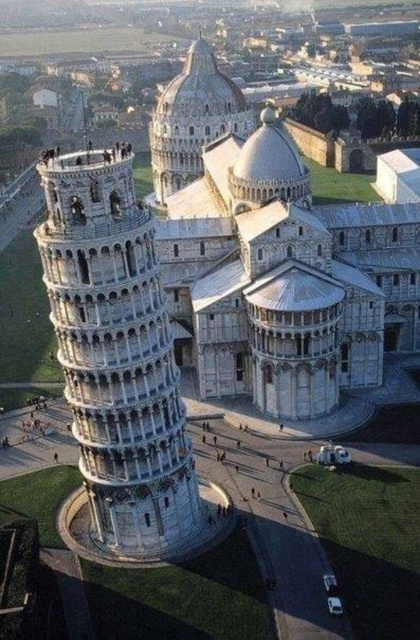
You are standing in the Piazza dei Miracoli and want to take a photo that includes both the white stone tower at left and the white stone dome at upper center. Based on their positions, which one should you frame first in your camera viewfinder to ensure both are in the shot?

The white stone tower at left is below the white stone dome at upper center, so you should frame the white stone dome at upper center first in your camera viewfinder to ensure both are included in the shot.

You are an architect analyzing the Piazza dei Miracoli. Based on the image, which of the two structures, the white stone tower at left or the white stone dome at upper center, has a smaller diameter at its base?

The white stone tower at left has a smaller diameter at its base than the white stone dome at upper center.